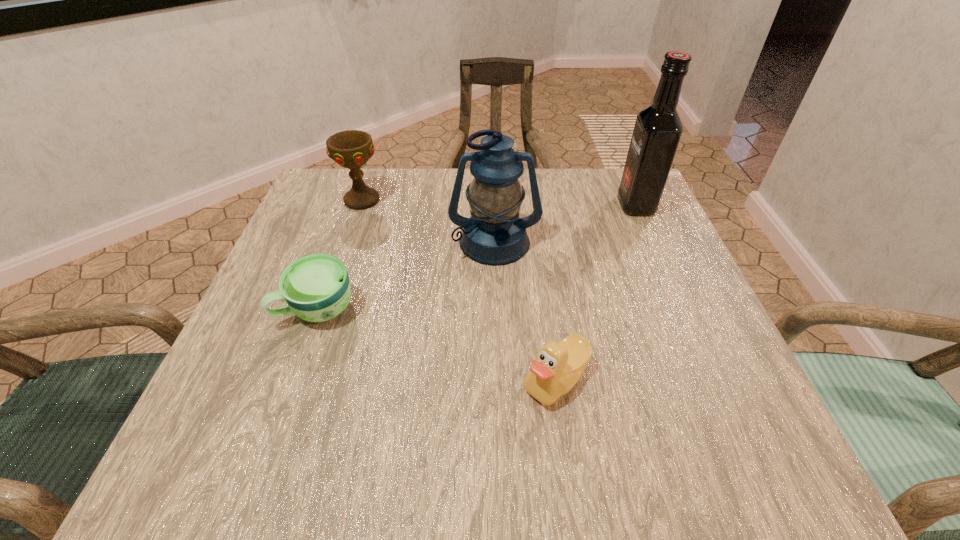
Locate an element on the screen. Image resolution: width=960 pixels, height=540 pixels. vacant space at the far left corner is located at coordinates (330, 208).

At what (x,y) coordinates should I click in order to perform the action: click on vacant space at the far right corner of the desktop. Please return your answer as a coordinate pair (x, y). This screenshot has height=540, width=960. Looking at the image, I should click on (660, 222).

This screenshot has width=960, height=540. I want to click on empty location between the lantern and the cup, so click(x=406, y=275).

Where is `blank region between the liquor and the fourth shortest object`? This screenshot has width=960, height=540. blank region between the liquor and the fourth shortest object is located at coordinates (565, 224).

Find the location of `free space between the cup and the nearest object`. free space between the cup and the nearest object is located at coordinates (437, 345).

The image size is (960, 540). In order to click on vacant region between the third shortest object and the duck in this screenshot , I will do `click(459, 290)`.

Locate an element on the screen. The image size is (960, 540). vacant space that's between the duck and the shortest object is located at coordinates (437, 345).

Image resolution: width=960 pixels, height=540 pixels. I want to click on free spot between the liquor and the duck, so click(596, 292).

Where is `empty location between the cup and the chalice`? This screenshot has width=960, height=540. empty location between the cup and the chalice is located at coordinates (340, 254).

Where is `object that stands as the closest to the shortest object`? The image size is (960, 540). object that stands as the closest to the shortest object is located at coordinates (494, 235).